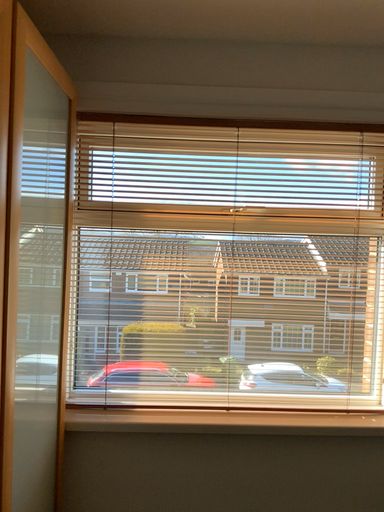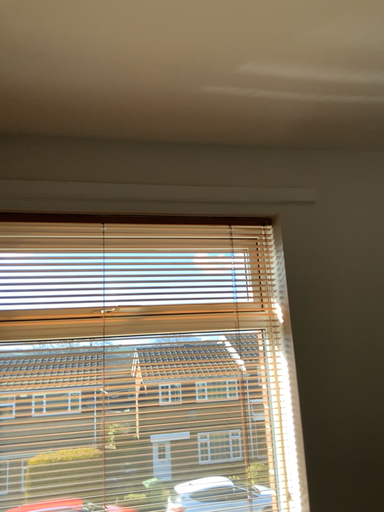
Question: How did the camera likely rotate when shooting the video?

Choices:
 (A) rotated upward
 (B) rotated downward

Answer: (A)